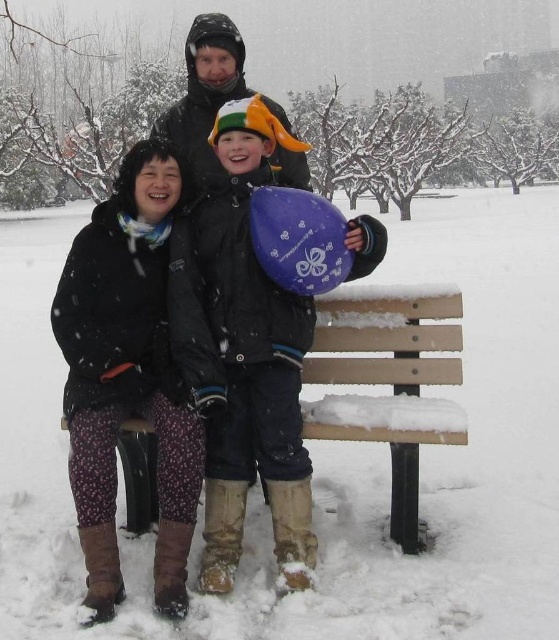
Question: Which object appears closest to the camera in this image?

Choices:
 (A) matte black jacket at upper center
 (B) wooden bench at center
 (C) purple matte balloon at center

Answer: (B)

Question: Is wooden bench at center wider than matte black jacket at upper center?

Choices:
 (A) no
 (B) yes

Answer: (A)

Question: Is purple matte balloon at center below wooden bench at center?

Choices:
 (A) no
 (B) yes

Answer: (A)

Question: Estimate the real-world distances between objects in this image. Which object is closer to the wooden bench at center?

Choices:
 (A) purple matte balloon at center
 (B) matte black jacket at upper center

Answer: (A)

Question: Which of these objects is positioned farthest from the matte black jacket at upper center?

Choices:
 (A) purple matte balloon at center
 (B) wooden bench at center

Answer: (B)

Question: Is purple matte balloon at center below wooden bench at center?

Choices:
 (A) yes
 (B) no

Answer: (B)